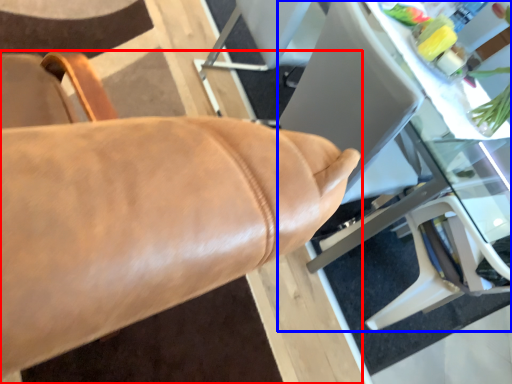
Question: Which of the following is the farthest to the observer, chair (highlighted by a red box) or table (highlighted by a blue box)?

Choices:
 (A) chair
 (B) table

Answer: (B)